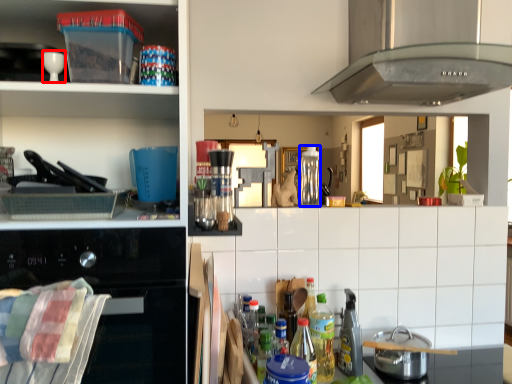
Question: Which object is closer to the camera taking this photo, appliance (highlighted by a red box) or bottle (highlighted by a blue box)?

Choices:
 (A) appliance
 (B) bottle

Answer: (A)